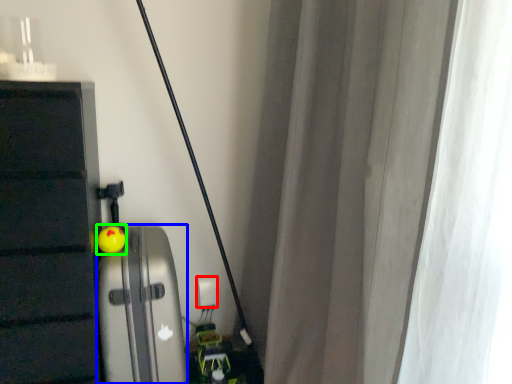
Question: Estimate the real-world distances between objects in this image. Which object is farther from electric outlet (highlighted by a red box), appliance (highlighted by a blue box) or toy (highlighted by a green box)?

Choices:
 (A) appliance
 (B) toy

Answer: (B)